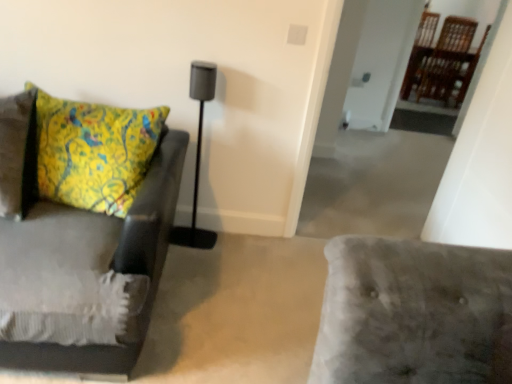
This screenshot has height=384, width=512. In order to click on vacant area that lies to the right of matte black speaker at center in this screenshot , I will do `click(226, 248)`.